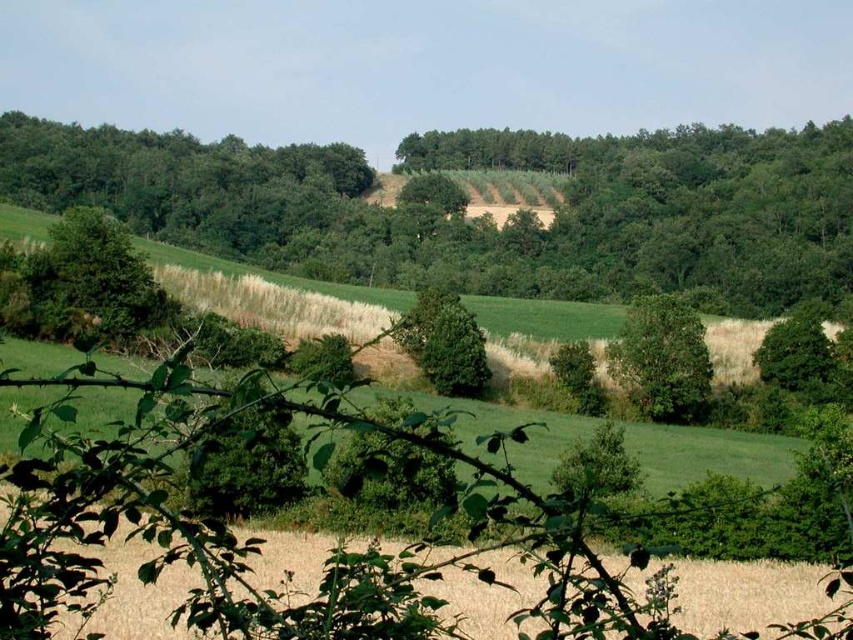
Locate an element on the screen. green leafy tree at upper center is located at coordinates (480, 228).

Can you confirm if green leafy tree at upper center is thinner than green leafy tree at left?

No, green leafy tree at upper center is not thinner than green leafy tree at left.

Describe the element at coordinates (480, 228) in the screenshot. I see `green leafy tree at upper center` at that location.

Locate an element on the screen. This screenshot has height=640, width=853. green leafy tree at upper center is located at coordinates (480, 228).

Does green leafy tree at left have a larger size compared to green leafy tree at center-right?

No, green leafy tree at left is not bigger than green leafy tree at center-right.

Is point (44, 253) closer to viewer compared to point (817, 332)?

Yes.

At what (x,y) coordinates should I click in order to perform the action: click on green leafy tree at left. Please return your answer as a coordinate pair (x, y). Looking at the image, I should click on (90, 280).

Who is shorter, green leafy tree at upper center or green leafy tree at center-right?

Standing shorter between the two is green leafy tree at center-right.

Does green leafy tree at upper center appear under green leafy tree at center-right?

Incorrect, green leafy tree at upper center is not positioned below green leafy tree at center-right.

Is point (494, 269) positioned before point (819, 344)?

That is False.

The height and width of the screenshot is (640, 853). In order to click on green leafy tree at upper center in this screenshot , I will do `click(480, 228)`.